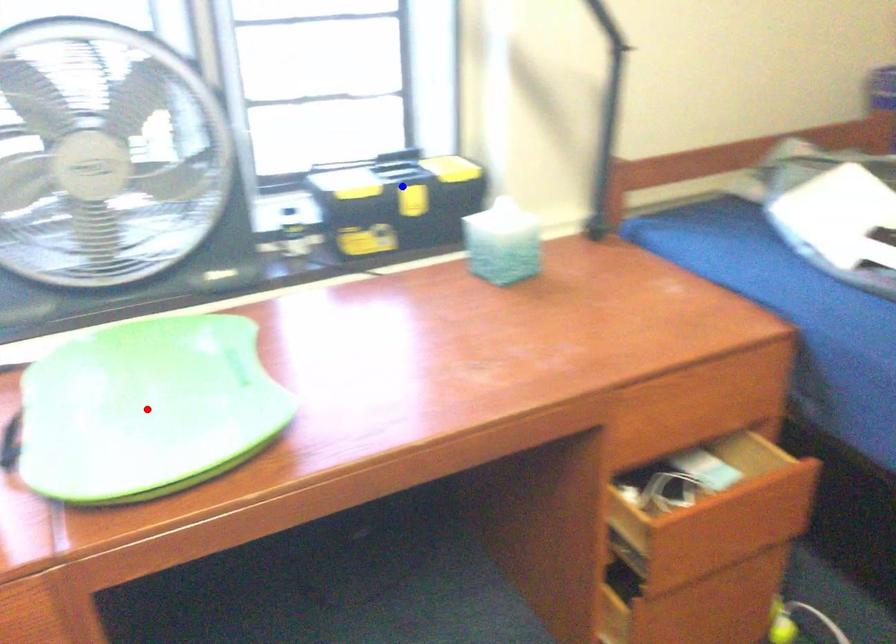
Question: Two points are marked on the image. Which point is closer to the camera?

Choices:
 (A) Blue point is closer.
 (B) Red point is closer.

Answer: (B)